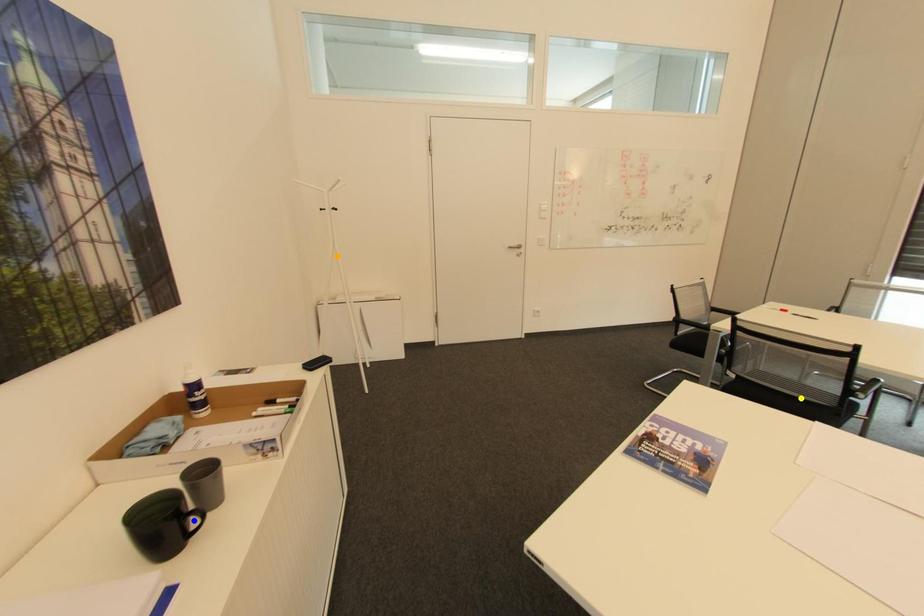
Order these from farthest to nearest:
orange point
blue point
yellow point

orange point < yellow point < blue point